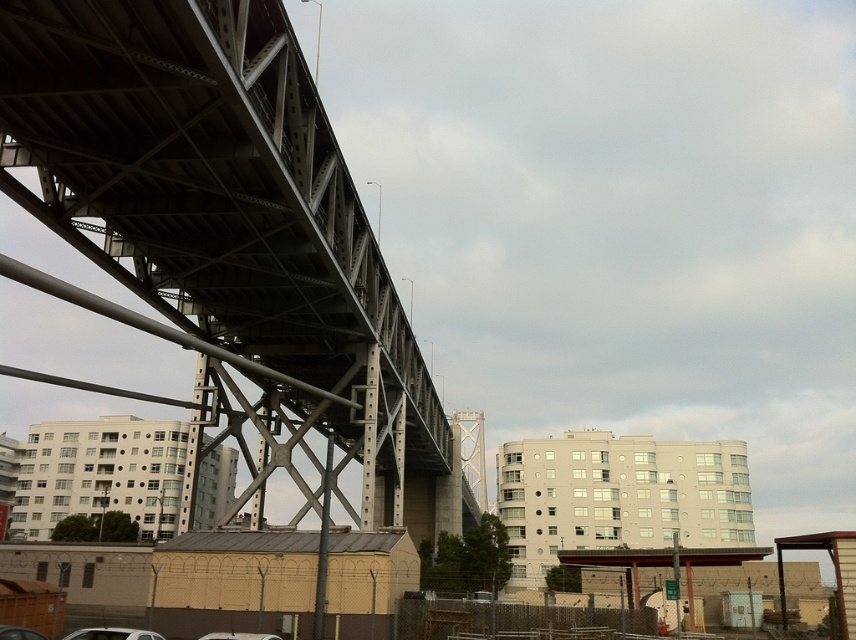
Question: Is metallic gray bridge at upper left to the right of white matte car at lower left from the viewer's perspective?

Choices:
 (A) no
 (B) yes

Answer: (A)

Question: Which of the following is the closest to the observer?

Choices:
 (A) metallic gray bridge at upper left
 (B) white matte car at lower left

Answer: (A)

Question: Can you confirm if metallic gray bridge at upper left is smaller than white matte car at lower left?

Choices:
 (A) yes
 (B) no

Answer: (B)

Question: Which point is closer to the camera?

Choices:
 (A) metallic gray bridge at upper left
 (B) white matte car at lower left

Answer: (A)

Question: Is metallic gray bridge at upper left positioned before white matte car at lower left?

Choices:
 (A) no
 (B) yes

Answer: (B)